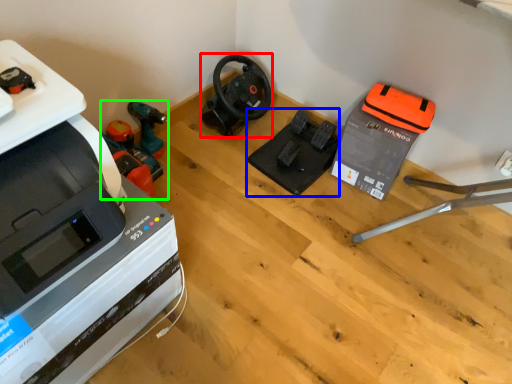
Question: Based on their relative distances, which object is farther from vacuum (highlighted by a red box)? Choose from equipment (highlighted by a blue box) and vacuum (highlighted by a green box).

Choices:
 (A) equipment
 (B) vacuum

Answer: (B)